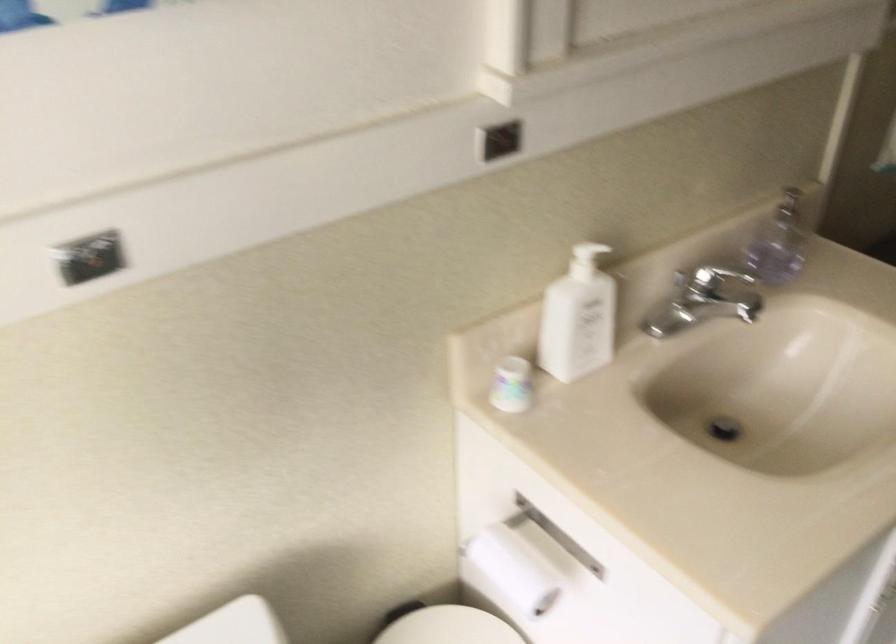
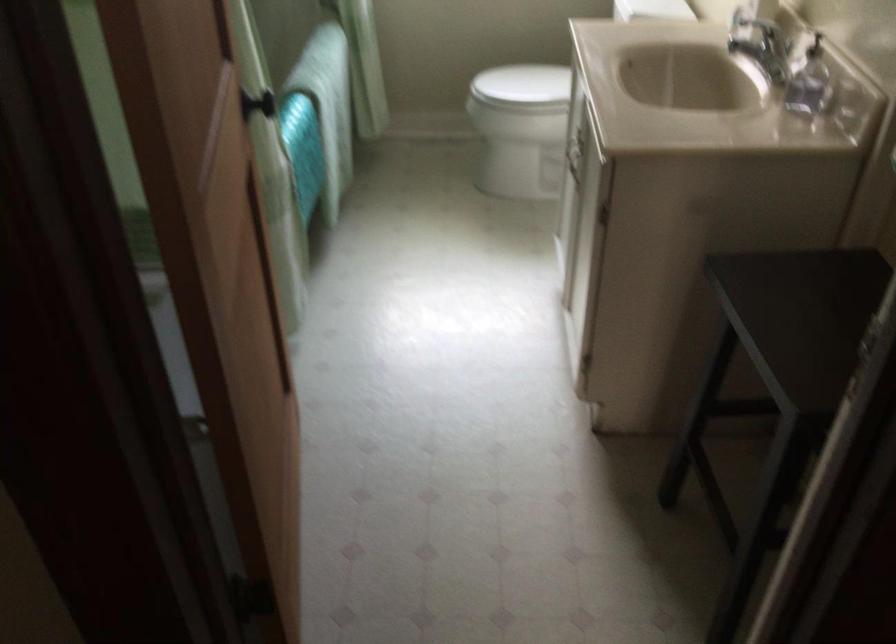
In the second image, find the point that corresponds to pixel 610 337 in the first image.

(760, 44)